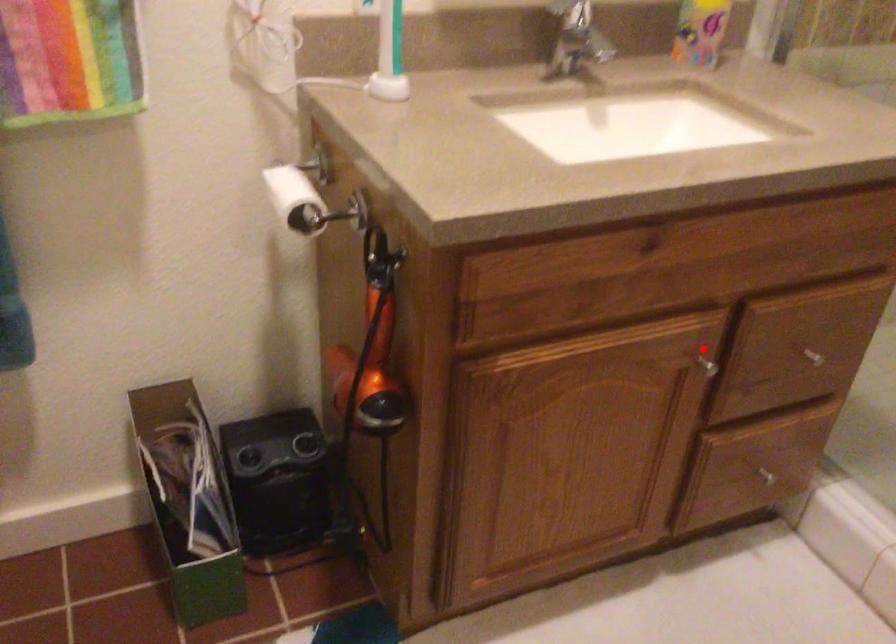
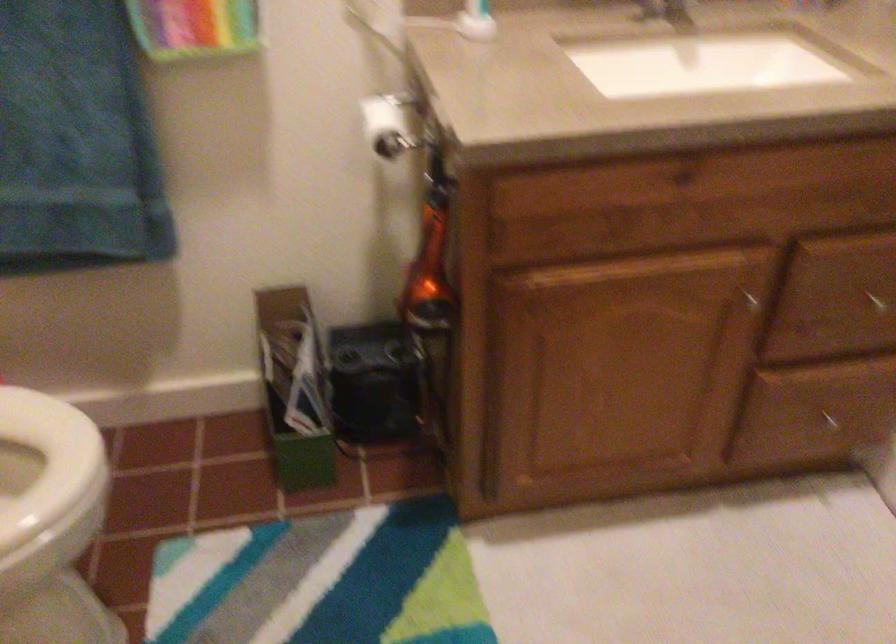
Find the pixel in the second image that matches the highlighted location in the first image.

(752, 285)